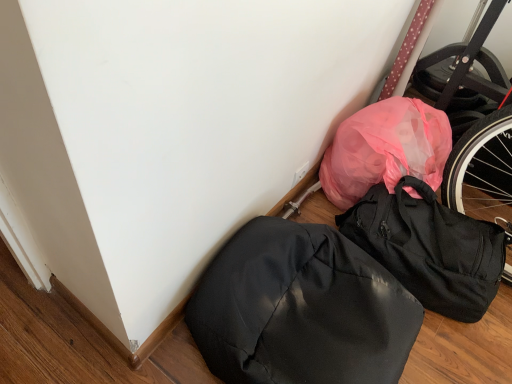
Question: Does glossy black backpack at lower right, the 2th backpack viewed from the right, have a greater width compared to matte black backpack at lower right, the second backpack when ordered from left to right?

Choices:
 (A) no
 (B) yes

Answer: (B)

Question: Is glossy black backpack at lower right, the 2th backpack viewed from the right, aimed at matte black backpack at lower right, the second backpack when ordered from left to right?

Choices:
 (A) no
 (B) yes

Answer: (A)

Question: Is glossy black backpack at lower right, the 2th backpack viewed from the right, shorter than matte black backpack at lower right, the second backpack when ordered from left to right?

Choices:
 (A) no
 (B) yes

Answer: (B)

Question: Is glossy black backpack at lower right, which is counted as the first backpack, starting from the left, at the right side of matte black backpack at lower right, the second backpack when ordered from left to right?

Choices:
 (A) no
 (B) yes

Answer: (A)

Question: From the image's perspective, is glossy black backpack at lower right, which is counted as the first backpack, starting from the left, on matte black backpack at lower right, which is counted as the first backpack, starting from the right?

Choices:
 (A) yes
 (B) no

Answer: (B)

Question: Is glossy black backpack at lower right, the 2th backpack viewed from the right, turned away from matte black backpack at lower right, the second backpack when ordered from left to right?

Choices:
 (A) yes
 (B) no

Answer: (B)

Question: Is matte black backpack at lower right, which is counted as the first backpack, starting from the right, thinner than glossy black backpack at lower right, the 2th backpack viewed from the right?

Choices:
 (A) yes
 (B) no

Answer: (A)

Question: Does matte black backpack at lower right, which is counted as the first backpack, starting from the right, turn towards glossy black backpack at lower right, which is counted as the first backpack, starting from the left?

Choices:
 (A) yes
 (B) no

Answer: (B)

Question: Can you confirm if matte black backpack at lower right, which is counted as the first backpack, starting from the right, is positioned to the right of glossy black backpack at lower right, which is counted as the first backpack, starting from the left?

Choices:
 (A) no
 (B) yes

Answer: (B)

Question: From a real-world perspective, is matte black backpack at lower right, which is counted as the first backpack, starting from the right, positioned over glossy black backpack at lower right, which is counted as the first backpack, starting from the left, based on gravity?

Choices:
 (A) yes
 (B) no

Answer: (B)

Question: Does matte black backpack at lower right, the second backpack when ordered from left to right, have a greater width compared to glossy black backpack at lower right, which is counted as the first backpack, starting from the left?

Choices:
 (A) yes
 (B) no

Answer: (B)

Question: Can you confirm if matte black backpack at lower right, the second backpack when ordered from left to right, is smaller than glossy black backpack at lower right, which is counted as the first backpack, starting from the left?

Choices:
 (A) yes
 (B) no

Answer: (A)

Question: Is matte black backpack at lower right, which is counted as the first backpack, starting from the right, in front of or behind glossy black backpack at lower right, which is counted as the first backpack, starting from the left, in the image?

Choices:
 (A) front
 (B) behind

Answer: (B)